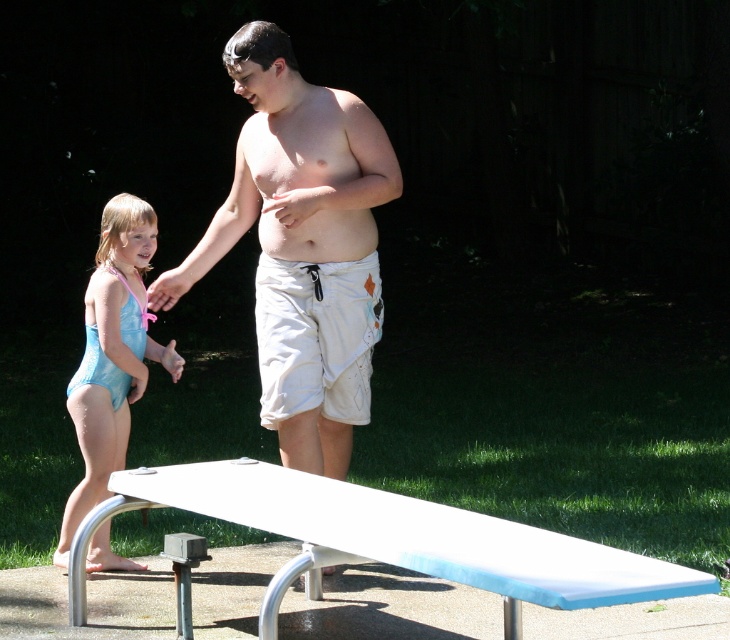
Question: Estimate the real-world distances between objects in this image. Which object is farther from the white glossy diving board at center?

Choices:
 (A) light blue swimsuit at left
 (B) white cotton shorts at center

Answer: (B)

Question: Is white glossy diving board at center positioned at the back of light blue swimsuit at left?

Choices:
 (A) no
 (B) yes

Answer: (A)

Question: Which point is farther to the camera?

Choices:
 (A) (338, 412)
 (B) (172, 468)

Answer: (A)

Question: Can you confirm if white cotton shorts at center is thinner than light blue swimsuit at left?

Choices:
 (A) yes
 (B) no

Answer: (B)

Question: Which point appears farthest from the camera in this image?

Choices:
 (A) (677, 564)
 (B) (126, 268)

Answer: (B)

Question: Does white glossy diving board at center appear over light blue swimsuit at left?

Choices:
 (A) no
 (B) yes

Answer: (A)